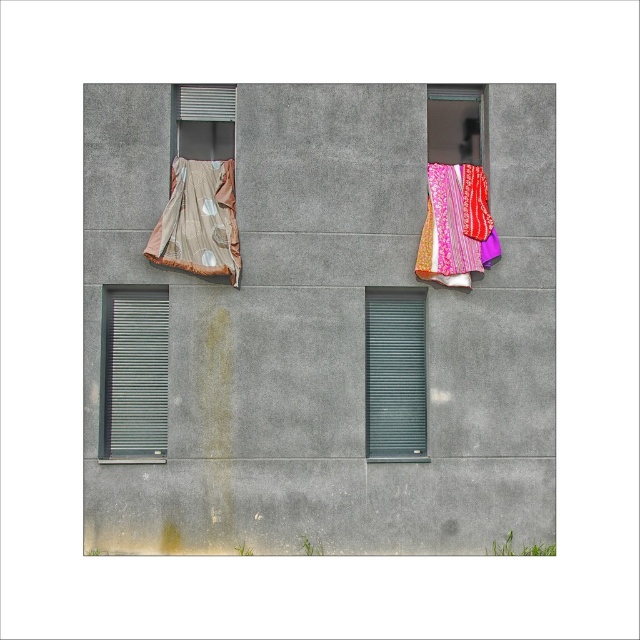
Question: Does matte gray shutter at left lie in front of shiny metallic curtain at upper left?

Choices:
 (A) yes
 (B) no

Answer: (B)

Question: Which object is closer to the camera taking this photo?

Choices:
 (A) green matte shutter at center
 (B) textured concrete wall at center

Answer: (B)

Question: Does matte gray shutter at left appear over pink patterned fabric at upper right?

Choices:
 (A) no
 (B) yes

Answer: (A)

Question: Which of the following is the closest to the observer?

Choices:
 (A) (397, 310)
 (B) (124, 330)
 (C) (200, 244)

Answer: (C)

Question: Does matte gray shutter at left have a lesser width compared to shiny metallic curtain at upper left?

Choices:
 (A) no
 (B) yes

Answer: (B)

Question: Which point appears closest to the camera in this image?

Choices:
 (A) (113, 321)
 (B) (422, 300)

Answer: (A)